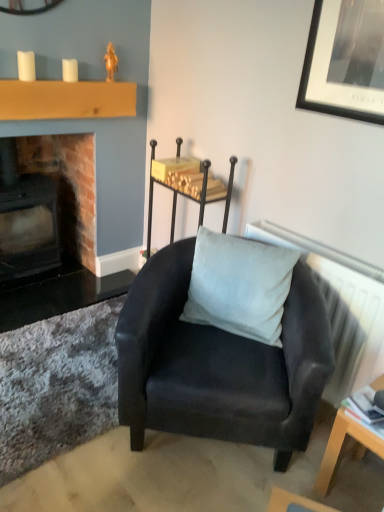
Question: Is point (29, 256) positioned closer to the camera than point (291, 389)?

Choices:
 (A) farther
 (B) closer

Answer: (A)

Question: In terms of height, does brick fireplace at left look taller or shorter compared to matte black armchair at center?

Choices:
 (A) short
 (B) tall

Answer: (B)

Question: Which object is the farthest from the satin black chair at center?

Choices:
 (A) brick fireplace at left
 (B) white textured radiator at upper right
 (C) satin white pillow at center
 (D) light wood/wooden table at lower right
 (E) wooden mantle at upper left

Answer: (D)

Question: Estimate the real-world distances between objects in this image. Which object is farther from the light wood/wooden table at lower right?

Choices:
 (A) brick fireplace at left
 (B) matte black armchair at center
 (C) white textured radiator at upper right
 (D) satin black chair at center
 (E) satin white pillow at center

Answer: (A)